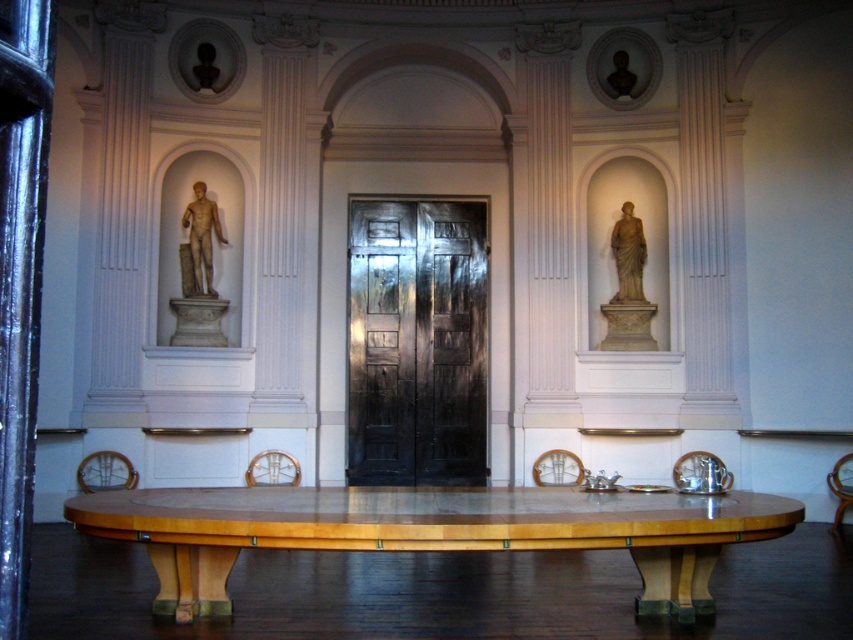
Question: Which of the following is the farthest from the observer?

Choices:
 (A) (180, 273)
 (B) (157, 547)

Answer: (A)

Question: Does black polished wood door at center have a lesser width compared to matte gray statue at right?

Choices:
 (A) yes
 (B) no

Answer: (B)

Question: Among these points, which one is farthest from the camera?

Choices:
 (A) (189, 294)
 (B) (416, 445)
 (C) (689, 572)

Answer: (B)

Question: Is marble statue at left closer to camera compared to matte gray statue at right?

Choices:
 (A) no
 (B) yes

Answer: (B)

Question: Which point appears closest to the camera in this image?

Choices:
 (A) 628,248
 (B) 373,401

Answer: (A)

Question: Does light wood table at center appear under marble statue at left?

Choices:
 (A) no
 (B) yes

Answer: (B)